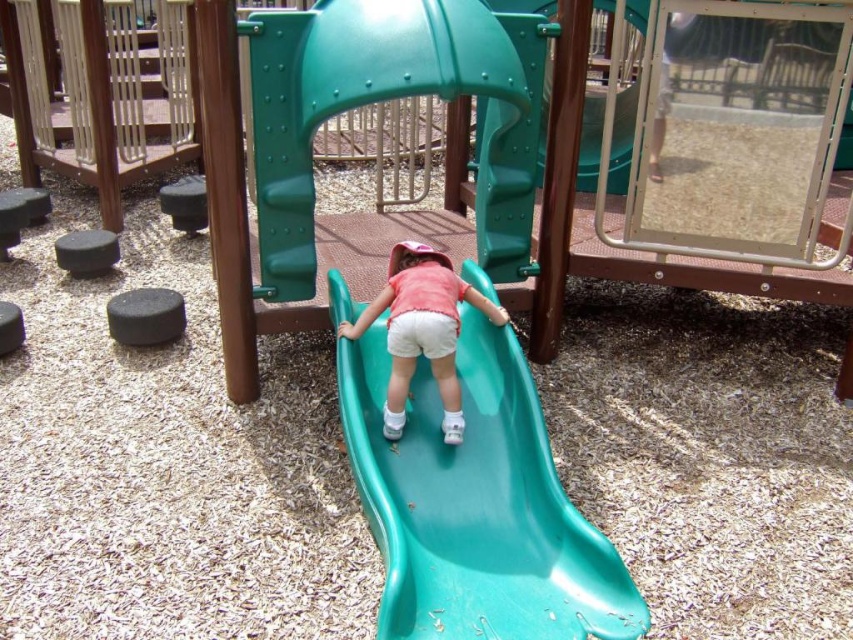
Question: Which object appears farthest from the camera in this image?

Choices:
 (A) green plastic slide at center
 (B) matte plastic slide at center

Answer: (B)

Question: Is green plastic slide at center positioned before matte plastic slide at center?

Choices:
 (A) no
 (B) yes

Answer: (B)

Question: Does green plastic slide at center have a greater width compared to matte plastic slide at center?

Choices:
 (A) yes
 (B) no

Answer: (A)

Question: Observing the image, what is the correct spatial positioning of green plastic slide at center in reference to matte plastic slide at center?

Choices:
 (A) below
 (B) above

Answer: (A)

Question: Which object appears farthest from the camera in this image?

Choices:
 (A) green plastic slide at center
 (B) matte plastic slide at center

Answer: (B)